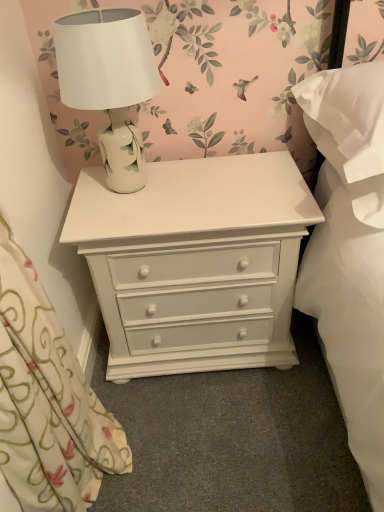
From the picture: Measure the distance between point (x=286, y=298) and camera.

The depth of point (x=286, y=298) is 1.27 meters.

This screenshot has width=384, height=512. Find the location of `white soft pillow at right`. white soft pillow at right is located at coordinates (350, 131).

This screenshot has width=384, height=512. I want to click on floral fabric curtain at left, so click(x=47, y=400).

What are the coordinates of `white ceramic lamp at upper center` in the screenshot? It's located at (109, 83).

This screenshot has height=512, width=384. What do you see at coordinates (109, 83) in the screenshot? I see `white ceramic lamp at upper center` at bounding box center [109, 83].

Where is `white painted wood chest of drawers at center`? white painted wood chest of drawers at center is located at coordinates (195, 262).

Considering the relative sizes of floral fabric curtain at left and white soft pillow at right in the image provided, is floral fabric curtain at left bigger than white soft pillow at right?

Indeed, floral fabric curtain at left has a larger size compared to white soft pillow at right.

What's the angular difference between floral fabric curtain at left and white soft pillow at right's facing directions?

There is a 86.6-degree angle between the facing directions of floral fabric curtain at left and white soft pillow at right.

Does floral fabric curtain at left touch white soft pillow at right?

No, floral fabric curtain at left is not with white soft pillow at right.

Based on the photo, which of these two, floral fabric curtain at left or white painted wood chest of drawers at center, is thinner?

With smaller width is floral fabric curtain at left.

This screenshot has height=512, width=384. What are the coordinates of `curtain below the white painted wood chest of drawers at center (from the image's perspective)` in the screenshot? It's located at (47, 400).

From a real-world perspective, is floral fabric curtain at left positioned above or below white painted wood chest of drawers at center?

From a real-world perspective, floral fabric curtain at left is physically above white painted wood chest of drawers at center.

Which point is more distant from viewer, (x=78, y=437) or (x=222, y=191)?

The point (x=222, y=191) is farther.

Does point (377, 165) come behind point (17, 449)?

That is False.

From the image's perspective, is white soft pillow at right located beneath floral fabric curtain at left?

Actually, white soft pillow at right appears above floral fabric curtain at left in the image.

Is the depth of white soft pillow at right greater than that of floral fabric curtain at left?

Yes.

Considering the relative positions of white soft pillow at right and floral fabric curtain at left in the image provided, is white soft pillow at right to the left or to the right of floral fabric curtain at left?

Based on their positions, white soft pillow at right is located to the right of floral fabric curtain at left.

From a real-world perspective, who is located higher, white soft pillow at right or white painted wood chest of drawers at center?

In real-world perspective, white soft pillow at right is above.

What are the coordinates of `pillow on the right of white painted wood chest of drawers at center` in the screenshot? It's located at (350, 131).

Does white soft pillow at right have a greater height compared to white painted wood chest of drawers at center?

In fact, white soft pillow at right may be shorter than white painted wood chest of drawers at center.

Considering their positions, is floral fabric curtain at left located in front of or behind white ceramic lamp at upper center?

Visually, floral fabric curtain at left is located in front of white ceramic lamp at upper center.

Between floral fabric curtain at left and white ceramic lamp at upper center, which one has more height?

With more height is floral fabric curtain at left.

Which of these two, floral fabric curtain at left or white ceramic lamp at upper center, is bigger?

floral fabric curtain at left.

Considering the points (126, 367) and (101, 106), which point is behind, point (126, 367) or point (101, 106)?

Positioned behind is point (126, 367).

From a real-world perspective, does white painted wood chest of drawers at center sit lower than white ceramic lamp at upper center?

Indeed, from a real-world perspective, white painted wood chest of drawers at center is positioned beneath white ceramic lamp at upper center.

Based on the photo, is white painted wood chest of drawers at center to the left or to the right of white ceramic lamp at upper center in the image?

Based on their positions, white painted wood chest of drawers at center is located to the right of white ceramic lamp at upper center.

From a real-world perspective, is white soft pillow at right under white ceramic lamp at upper center?

Correct, in the physical world, white soft pillow at right is lower than white ceramic lamp at upper center.

The image size is (384, 512). What are the coordinates of `lamp on the left of white soft pillow at right` in the screenshot? It's located at (109, 83).

Which of these two, white soft pillow at right or white ceramic lamp at upper center, stands shorter?

white soft pillow at right.

Locate an element on the screen. curtain on the left of the white soft pillow at right is located at coordinates (47, 400).

Identify the location of curtain that is above the white painted wood chest of drawers at center (from a real-world perspective). [47, 400].

From the image, which object appears to be nearer to floral fabric curtain at left, white soft pillow at right or white painted wood chest of drawers at center?

The object closer to floral fabric curtain at left is white painted wood chest of drawers at center.

Considering their positions, is white painted wood chest of drawers at center positioned closer to white ceramic lamp at upper center than white soft pillow at right?

The object closer to white ceramic lamp at upper center is white painted wood chest of drawers at center.

Looking at the image, which one is located further to white painted wood chest of drawers at center, white soft pillow at right or white ceramic lamp at upper center?

white soft pillow at right is further to white painted wood chest of drawers at center.

Looking at the image, which one is located closer to floral fabric curtain at left, white ceramic lamp at upper center or white soft pillow at right?

white ceramic lamp at upper center is closer to floral fabric curtain at left.

Considering their positions, is white soft pillow at right positioned closer to white painted wood chest of drawers at center than floral fabric curtain at left?

Among the two, white soft pillow at right is located nearer to white painted wood chest of drawers at center.

Looking at the image, which one is located further to white painted wood chest of drawers at center, floral fabric curtain at left or white soft pillow at right?

floral fabric curtain at left.

Which object lies further to the anchor point white ceramic lamp at upper center, floral fabric curtain at left or white soft pillow at right?

white soft pillow at right is positioned further to the anchor white ceramic lamp at upper center.

Considering their positions, is floral fabric curtain at left positioned further to white soft pillow at right than white painted wood chest of drawers at center?

floral fabric curtain at left is positioned further to the anchor white soft pillow at right.

Find the location of a particular element. The height and width of the screenshot is (512, 384). lamp located between floral fabric curtain at left and white painted wood chest of drawers at center in the depth direction is located at coordinates (109, 83).

At what (x,y) coordinates should I click in order to perform the action: click on pillow between floral fabric curtain at left and white painted wood chest of drawers at center in the front-back direction. Please return your answer as a coordinate pair (x, y). Looking at the image, I should click on (350, 131).

Locate an element on the screen. Image resolution: width=384 pixels, height=512 pixels. lamp located between floral fabric curtain at left and white soft pillow at right in the left-right direction is located at coordinates (109, 83).

Find the location of a particular element. the chest of drawers located between white ceramic lamp at upper center and white soft pillow at right in the left-right direction is located at coordinates [195, 262].